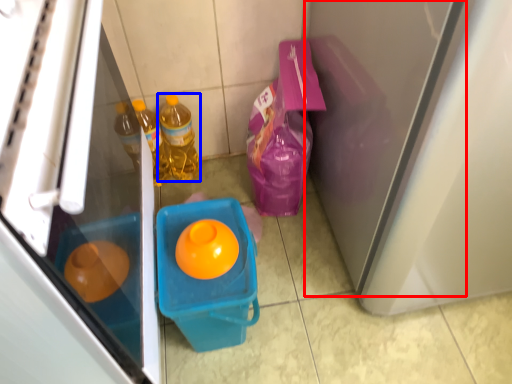
Question: Which object appears farthest to the camera in this image, screen door (highlighted by a red box) or bottle (highlighted by a blue box)?

Choices:
 (A) screen door
 (B) bottle

Answer: (B)